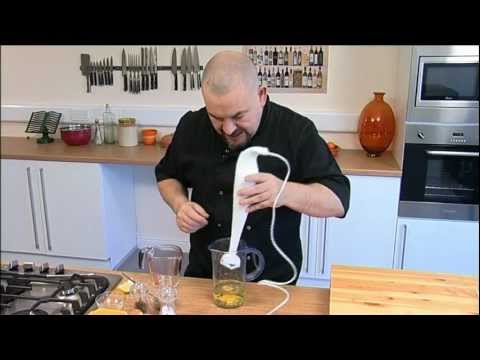
Image resolution: width=480 pixels, height=360 pixels. What are the coordinates of `counter` in the screenshot? It's located at (355, 166), (200, 294).